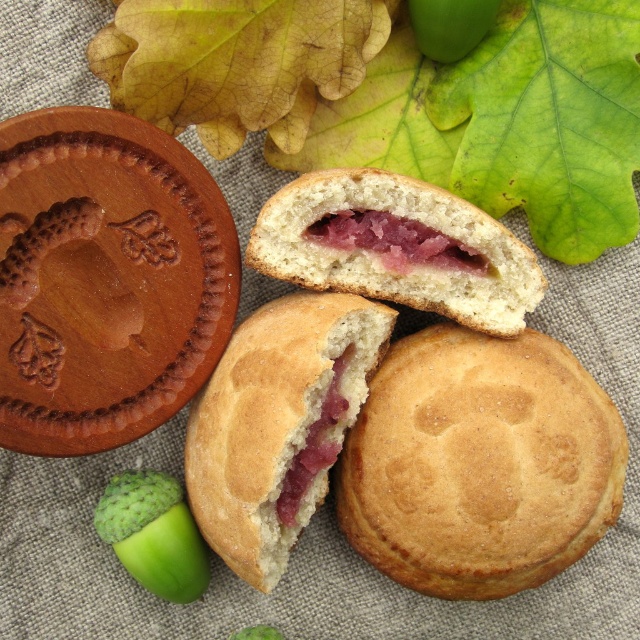
Is point (380, 493) more distant than point (369, 275)?

No, (380, 493) is closer to viewer.

Between point (419, 529) and point (506, 312), which one is positioned behind?

Positioned behind is point (506, 312).

Is point (474, 552) less distant than point (419, 253)?

That is True.

Image resolution: width=640 pixels, height=640 pixels. Find the location of `golden-brown crumbly biscuit at center`. golden-brown crumbly biscuit at center is located at coordinates 480,464.

Between golden crumbly biscuit at center and light brown crumbly biscuit at center, which one is positioned higher?

light brown crumbly biscuit at center is above.

Who is taller, golden crumbly biscuit at center or light brown crumbly biscuit at center?

golden crumbly biscuit at center

Does point (244, 385) lie behind point (321, 176)?

No, it is in front of (321, 176).

Find the location of a particular element. This screenshot has width=640, height=640. golden crumbly biscuit at center is located at coordinates (278, 422).

In the scene shown: Does golden-brown crumbly biscuit at center have a greater height compared to golden crumbly biscuit at center?

No.

Identify the location of golden-brown crumbly biscuit at center. This screenshot has width=640, height=640. (480, 464).

The image size is (640, 640). What are the coordinates of `golden-brown crumbly biscuit at center` in the screenshot? It's located at (480, 464).